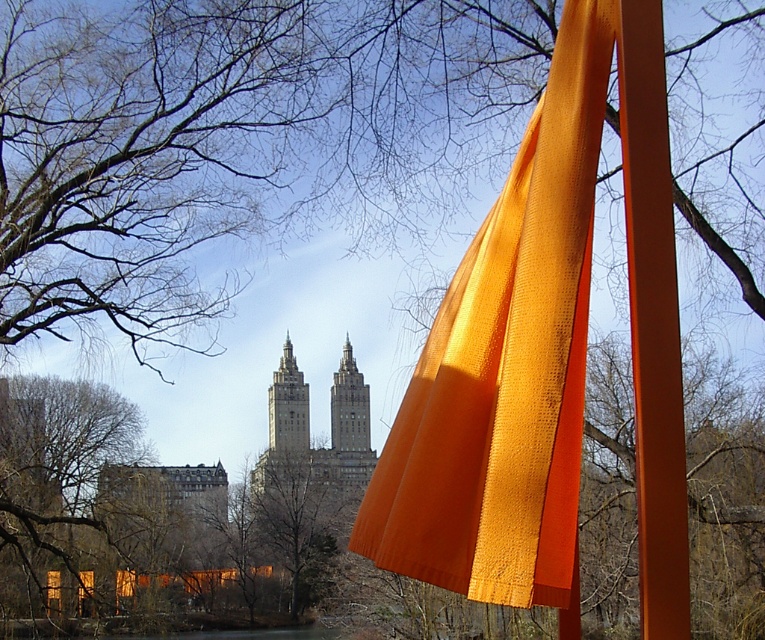
You are a GUI agent. You are given a task and a screenshot of the screen. Output one action in this format:
    pyautogui.click(x=<x>, y=<y>)
    Task: Click on the orange fabric at center
    This screenshot has height=640, width=765.
    Given the screenshot: What is the action you would take?
    pyautogui.click(x=505, y=365)

Find the location of a particular element. The image size is (765, 640). orange fabric at center is located at coordinates click(x=505, y=365).

Does orange fabric at center come in front of orange matte pole at right?

Yes, orange fabric at center is in front of orange matte pole at right.

Where is `orange fabric at center`? This screenshot has height=640, width=765. orange fabric at center is located at coordinates (505, 365).

This screenshot has height=640, width=765. I want to click on orange fabric at center, so click(x=505, y=365).

Is orange matte pole at right to the right of matte gray stone tower at center from the viewer's perspective?

Yes, orange matte pole at right is to the right of matte gray stone tower at center.

How much distance is there between orange matte pole at right and matte gray stone tower at center?

396.67 feet

Which is behind, point (666, 248) or point (256, 481)?

Positioned behind is point (256, 481).

At what (x,y) coordinates should I click in order to perform the action: click on orange matte pole at right. Please return your answer as a coordinate pair (x, y). The width and height of the screenshot is (765, 640). Looking at the image, I should click on (653, 323).